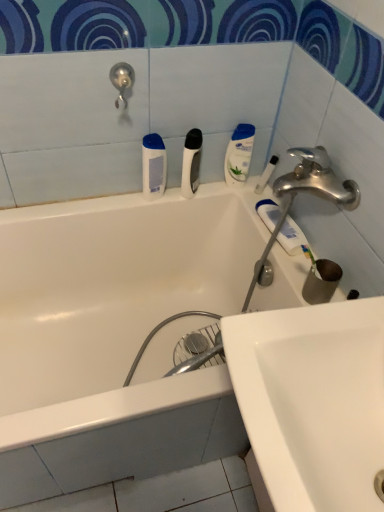
This screenshot has width=384, height=512. Find the location of `vacant space that's between white glossy lotion at upper right, which is the second toiletry from right to left, and white matte razor at center, arranged as the 3th toiletry when viewed from the right`. vacant space that's between white glossy lotion at upper right, which is the second toiletry from right to left, and white matte razor at center, arranged as the 3th toiletry when viewed from the right is located at coordinates (217, 186).